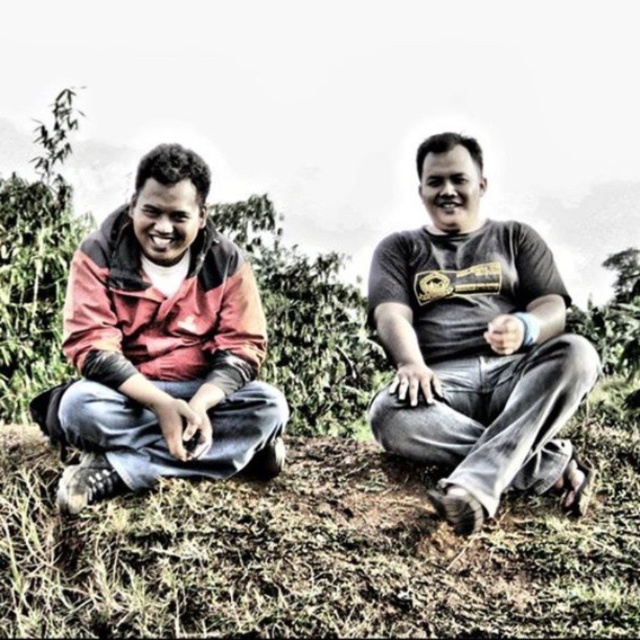
Question: Observing the image, what is the correct spatial positioning of dark gray t-shirt at center in reference to matte red jacket at left?

Choices:
 (A) below
 (B) above

Answer: (A)

Question: Which point is closer to the camera?

Choices:
 (A) green grass at center
 (B) dark gray t-shirt at center

Answer: (A)

Question: Which object is closer to the camera taking this photo?

Choices:
 (A) matte red jacket at left
 (B) green grass at center

Answer: (B)

Question: Can you confirm if green grass at center is bigger than dark gray t-shirt at center?

Choices:
 (A) no
 (B) yes

Answer: (B)

Question: Does dark gray t-shirt at center lie in front of matte red jacket at left?

Choices:
 (A) no
 (B) yes

Answer: (B)

Question: Based on their relative distances, which object is nearer to the matte red jacket at left?

Choices:
 (A) dark gray t-shirt at center
 (B) green grass at center

Answer: (B)